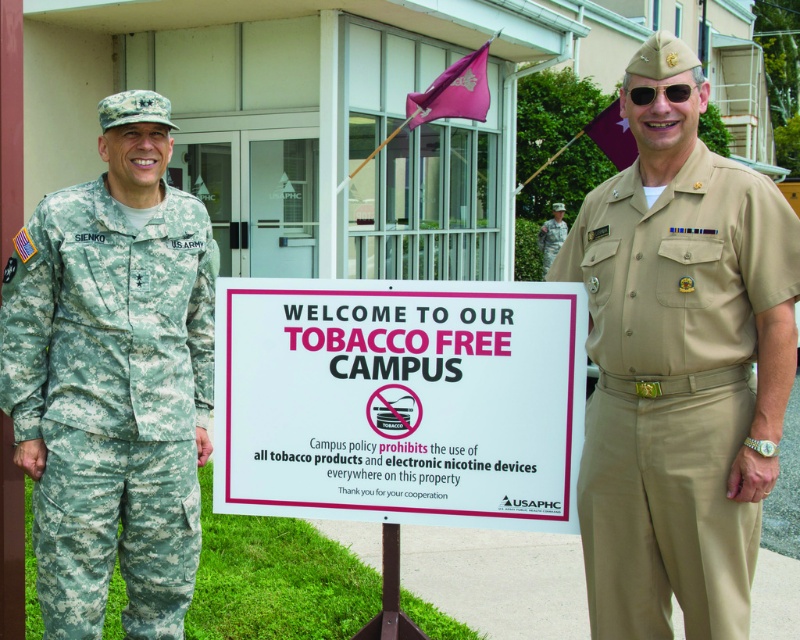
How far apart are the two people holding the white paper sign at center?

The two people holding the white paper sign at center are 10.15 feet apart.

You are a photographer trying to capture a closeup of the sign held by the two individuals. You notice two points on the sign labeled as point 1 at coordinates point (462,384) and point 2 at coordinates point (18,253). Which point would you focus on to ensure the closest part of the sign is in sharp focus?

Point (462,384) is closer to the camera than point (18,253), so focusing on point (462,384) would ensure the closest part of the sign is in sharp focus.